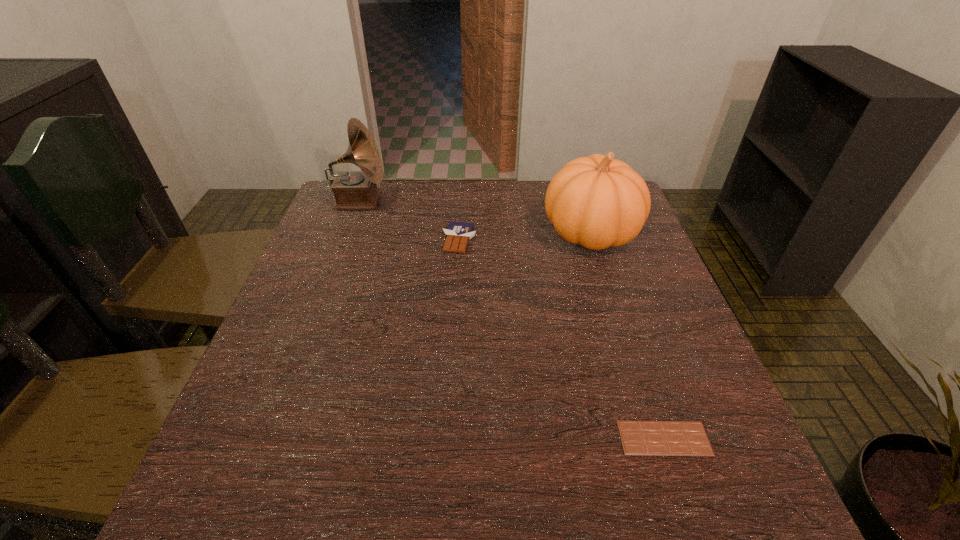
Locate an element on the screen. This screenshot has width=960, height=540. free location that satisfies the following two spatial constraints: 1. on the front side of the nearest object; 2. on the left side of the second object from left to right is located at coordinates (447, 438).

Where is `free spot that satisfies the following two spatial constraints: 1. on the horn of the phonograph record; 2. on the back side of the pumpkin`? free spot that satisfies the following two spatial constraints: 1. on the horn of the phonograph record; 2. on the back side of the pumpkin is located at coordinates (348, 232).